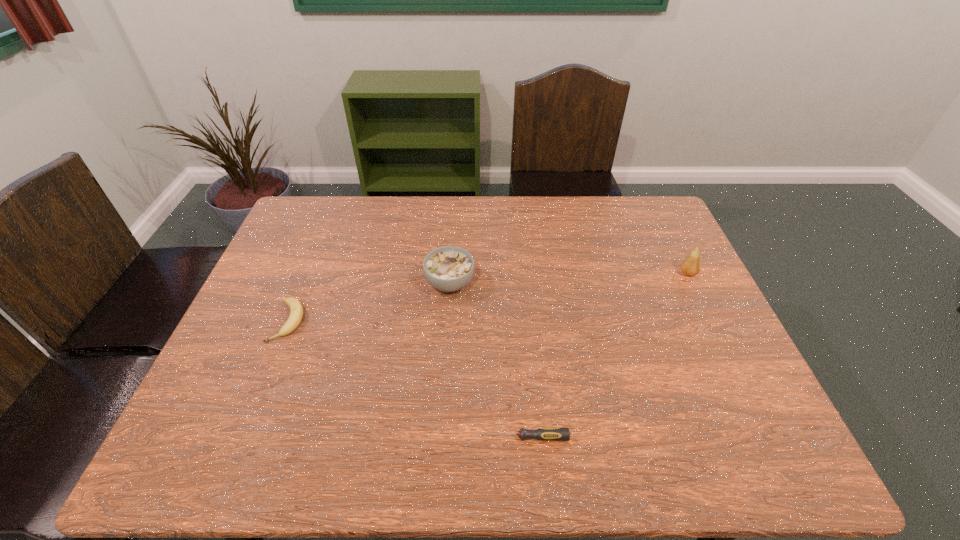
Image resolution: width=960 pixels, height=540 pixels. Find the location of `vacant space at the near right corner of the desktop`. vacant space at the near right corner of the desktop is located at coordinates (706, 435).

You are a GUI agent. You are given a task and a screenshot of the screen. Output one action in this format:
    pyautogui.click(x=<x>, y=<y>)
    Task: Click on the empty space that is in between the rightmost object and the screwdriver
    Image resolution: width=960 pixels, height=540 pixels.
    Given the screenshot: What is the action you would take?
    pyautogui.click(x=606, y=355)

Where is `vacant space that is in between the rightmost object and the leftmost object`? This screenshot has width=960, height=540. vacant space that is in between the rightmost object and the leftmost object is located at coordinates (488, 298).

Locate an element on the screen. This screenshot has width=960, height=540. vacant space that is in between the rightmost object and the third tallest object is located at coordinates (488, 298).

Image resolution: width=960 pixels, height=540 pixels. Find the location of `vacant area that lies between the second object from right to left and the pear`. vacant area that lies between the second object from right to left and the pear is located at coordinates (606, 355).

Where is `free spot between the leftmost object and the pear`? free spot between the leftmost object and the pear is located at coordinates (488, 298).

Locate an element on the screen. Image resolution: width=960 pixels, height=540 pixels. free space between the banana and the screwdriver is located at coordinates (406, 380).

The height and width of the screenshot is (540, 960). Find the location of `vacant point located between the leftmost object and the second object from left to right`. vacant point located between the leftmost object and the second object from left to right is located at coordinates (370, 302).

The width and height of the screenshot is (960, 540). I want to click on vacant point located between the leftmost object and the nearest object, so click(x=406, y=380).

Locate an element on the screen. The width and height of the screenshot is (960, 540). vacant point located between the soup bowl and the leftmost object is located at coordinates (370, 302).